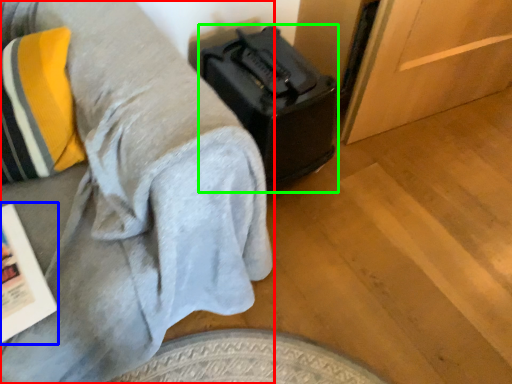
Question: Considering the real-world distances, which object is closest to furniture (highlighted by a red box)? magazine (highlighted by a blue box) or luggage (highlighted by a green box).

Choices:
 (A) magazine
 (B) luggage

Answer: (A)